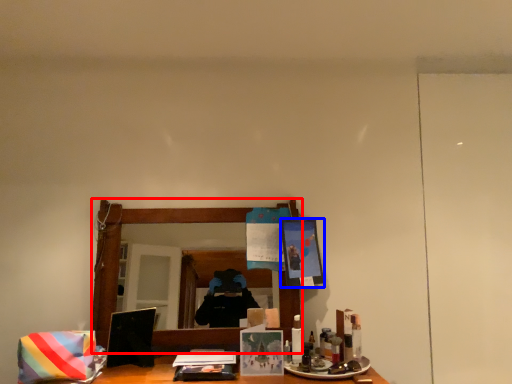
Question: Which point is closer to the camera, mirror (highlighted by a red box) or picture frame (highlighted by a blue box)?

Choices:
 (A) mirror
 (B) picture frame

Answer: (A)